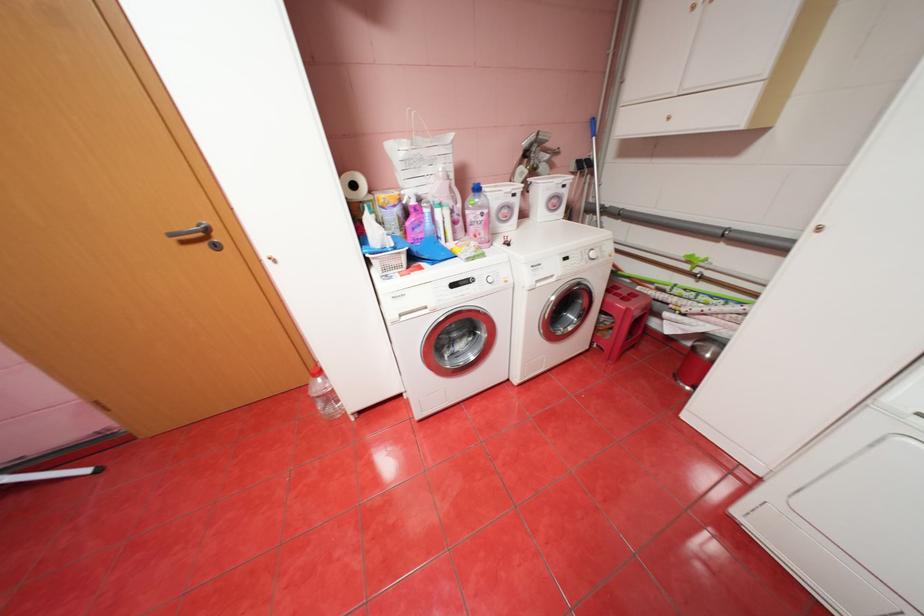
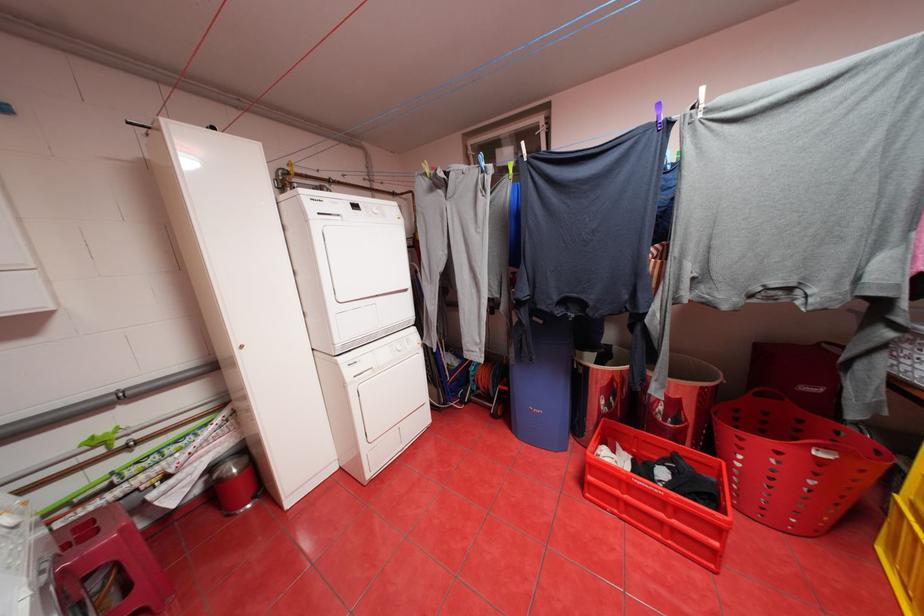
Where in the second image is the point corresponding to pixel 637 309 from the first image?

(130, 530)